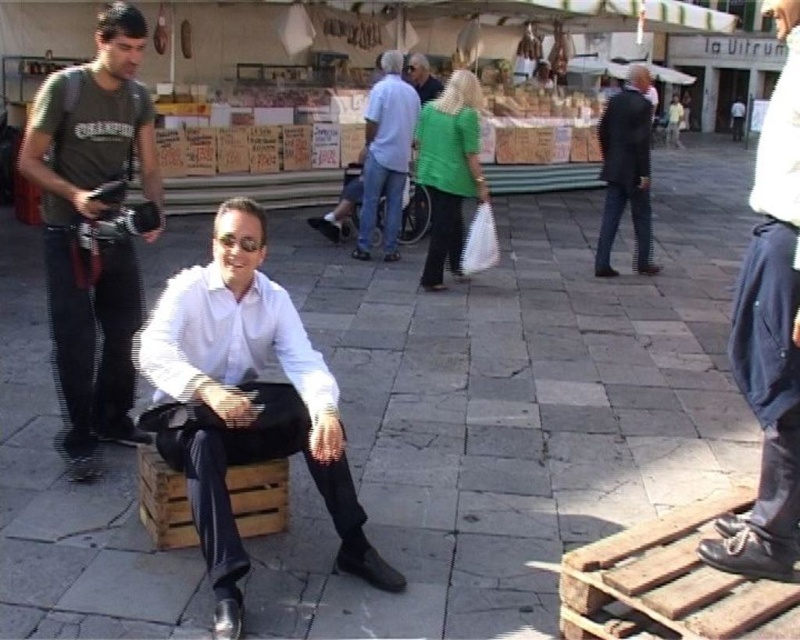
Question: Among these points, which one is nearest to the camera?

Choices:
 (A) (102, 280)
 (B) (421, 68)

Answer: (A)

Question: Can you confirm if dark gray suit at right is thinner than wooden crate at center?

Choices:
 (A) no
 (B) yes

Answer: (A)

Question: Does white matte shirt at center lie in front of dark gray suit at right?

Choices:
 (A) no
 (B) yes

Answer: (B)

Question: Does white matte shirt at center come behind wooden crate at center?

Choices:
 (A) yes
 (B) no

Answer: (B)

Question: Which point is closer to the camera taking this photo?

Choices:
 (A) (325, 420)
 (B) (117, 340)
 (C) (396, 220)

Answer: (A)

Question: Based on their relative distances, which object is farther from the light blue denim jeans at center?

Choices:
 (A) dark gray suit at right
 (B) matte green sweater at center
 (C) green matte jacket at center
 (D) dark blue jeans at lower right

Answer: (D)